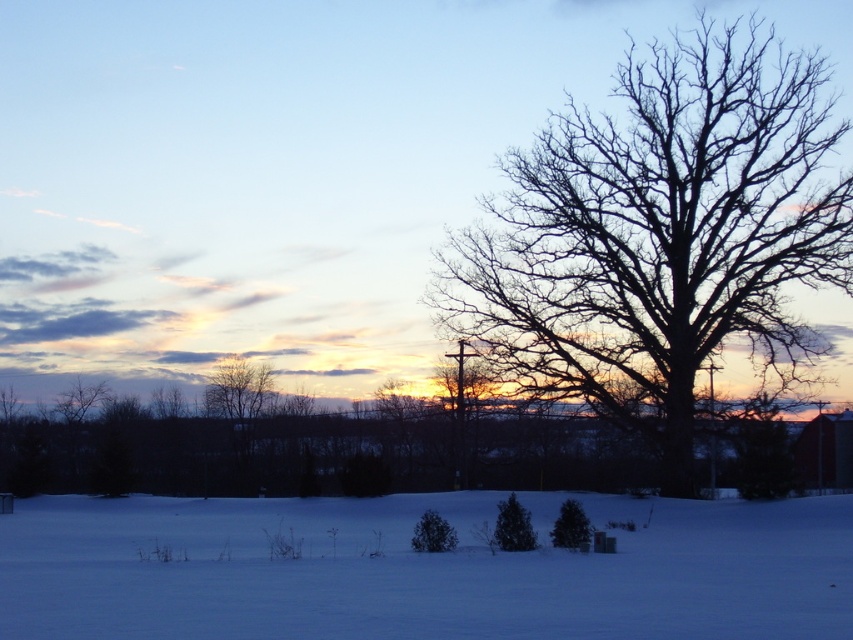
Question: Considering the real-world distances, which object is closest to the green matte evergreen at lower center?

Choices:
 (A) white powdery snow at lower center
 (B) black bare tree at right
 (C) green matte evergreen tree at center

Answer: (C)

Question: Is green matte evergreen at center below green matte evergreen at lower center?

Choices:
 (A) no
 (B) yes

Answer: (A)

Question: Is the position of black bare tree at right less distant than that of white powdery snow at lower center?

Choices:
 (A) no
 (B) yes

Answer: (A)

Question: Estimate the real-world distances between objects in this image. Which object is farther from the green matte evergreen at lower center?

Choices:
 (A) black bare tree at right
 (B) white powdery snow at lower center
 (C) green matte evergreen tree at center

Answer: (A)

Question: Can you confirm if black bare tree at right is positioned to the right of white powdery snow at lower center?

Choices:
 (A) yes
 (B) no

Answer: (A)

Question: Which point is farther to the camera?

Choices:
 (A) green matte evergreen tree at center
 (B) green matte evergreen at lower center
 (C) white powdery snow at lower center

Answer: (A)